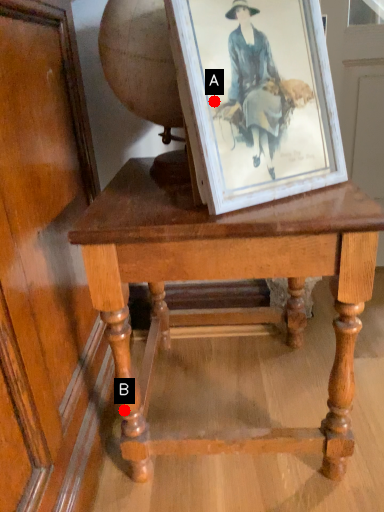
Question: Two points are circled on the image, labeled by A and B beside each circle. Which of the following is the farthest from the observer?

Choices:
 (A) A is further
 (B) B is further

Answer: (B)